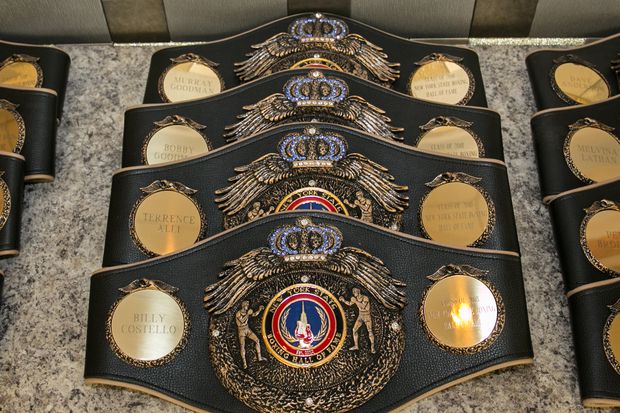
I want to click on name plates, so click(x=197, y=75), click(x=188, y=140), click(x=167, y=218), click(x=157, y=323), click(x=603, y=333), click(x=596, y=215), click(x=595, y=142), click(x=583, y=84).